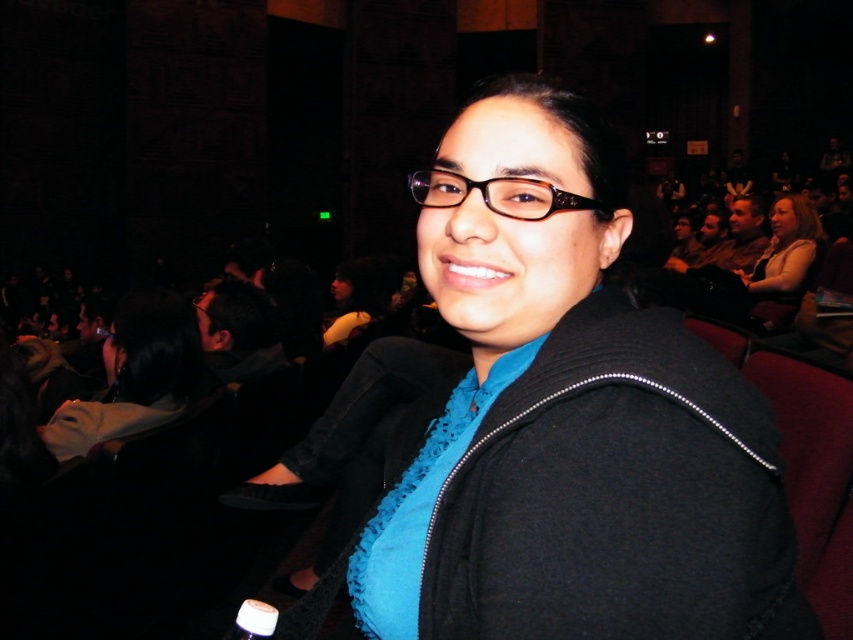
You are trying to decide between two jackets displayed in an online store. The matte black jacket at center and the black fabric jacket at center are both in your cart. Based on the image description, which jacket would you choose if you prefer a wider fit?

The matte black jacket at center has a larger width than the black fabric jacket at center, so it would be the better choice for a wider fit.

You are attending a conference and want to take a photo of the person at the center. The black fabric jacket at center and the brown textured glasses at center are both visible in the frame. Which object should you adjust your camera angle to focus on first if you want to ensure both are in the frame?

The black fabric jacket at center is positioned on the left side of brown textured glasses at center. To ensure both are in the frame, focus on the black fabric jacket at center first since it is on the left, then adjust to include the brown textured glasses at center on the right.